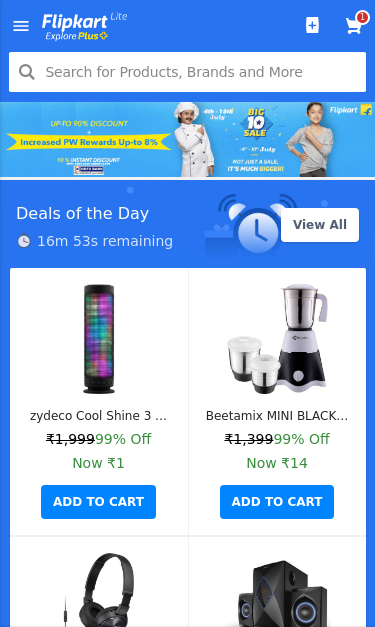
At what (x,y) coordinates should I click in order to perform the action: click on clock. Please return your answer as a coordinate pair (x, y). Image resolution: width=375 pixels, height=627 pixels. Looking at the image, I should click on point(258,232).